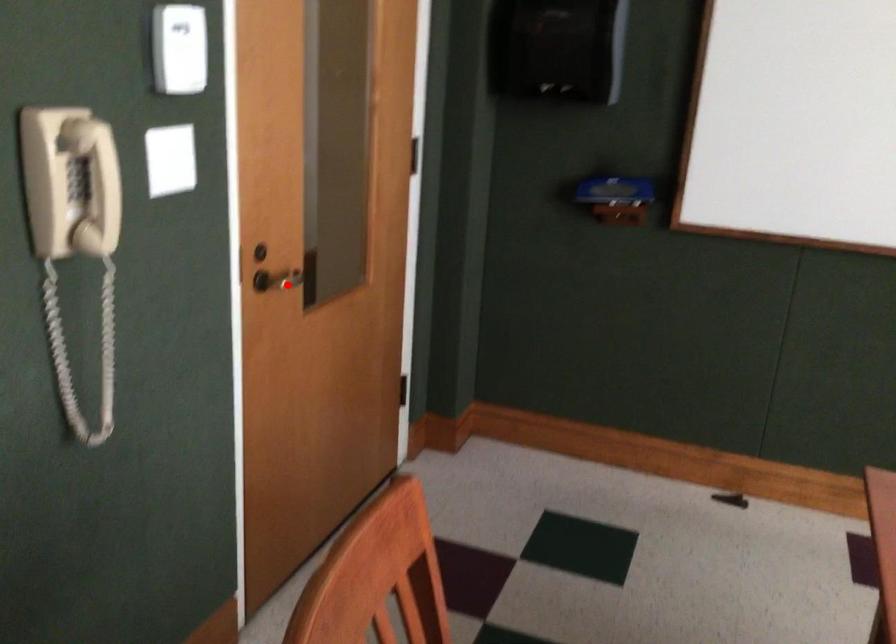
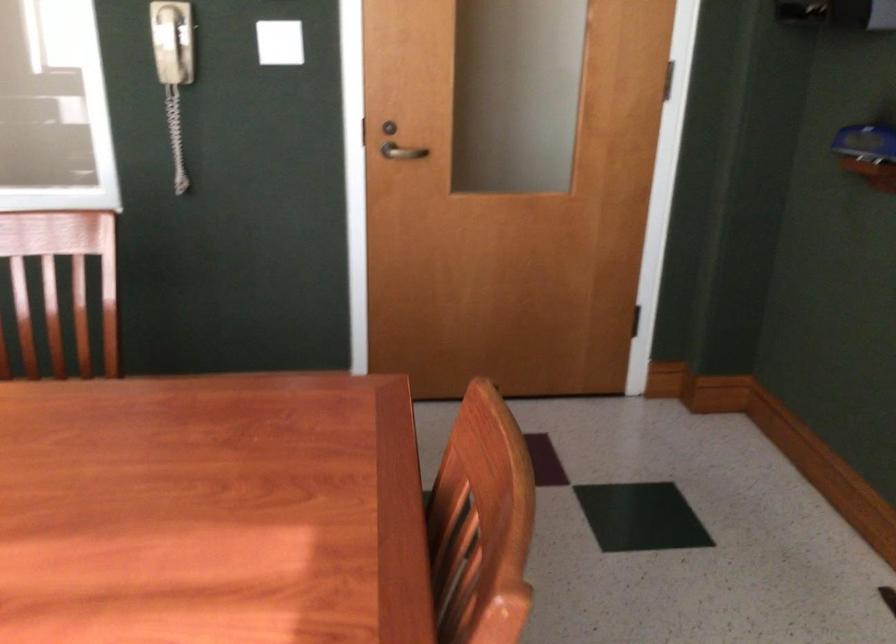
Locate, in the second image, the point that corresponds to the highlighted location in the first image.

(401, 152)